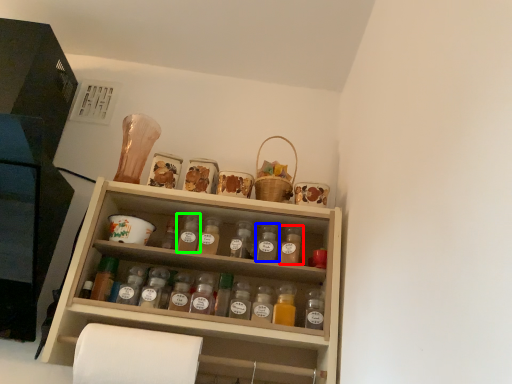
Question: Which is nearer to the bottle (highlighted by a red box)? bottle (highlighted by a blue box) or bottle (highlighted by a green box).

Choices:
 (A) bottle
 (B) bottle

Answer: (A)